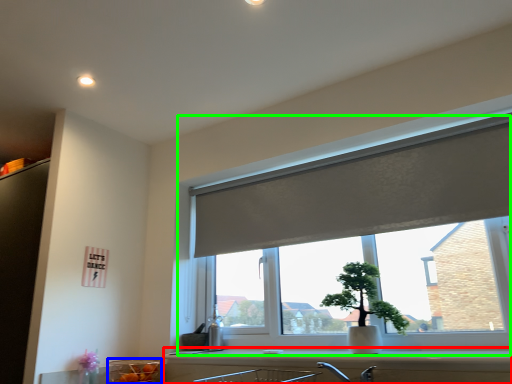
Question: Estimate the real-world distances between objects in this image. Which object is farther from counter top (highlighted by a red box), glass bowl (highlighted by a blue box) or window (highlighted by a green box)?

Choices:
 (A) glass bowl
 (B) window

Answer: (B)